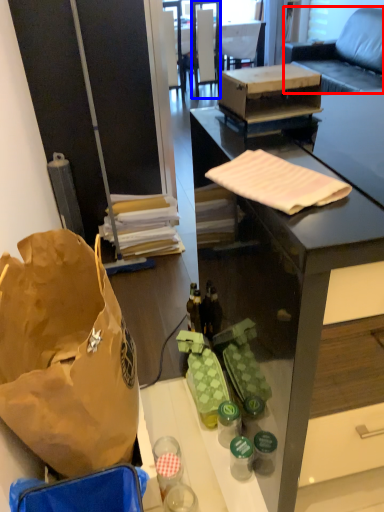
Question: Among these objects, which one is farthest to the camera, studio couch (highlighted by a red box) or chair (highlighted by a blue box)?

Choices:
 (A) studio couch
 (B) chair

Answer: (B)